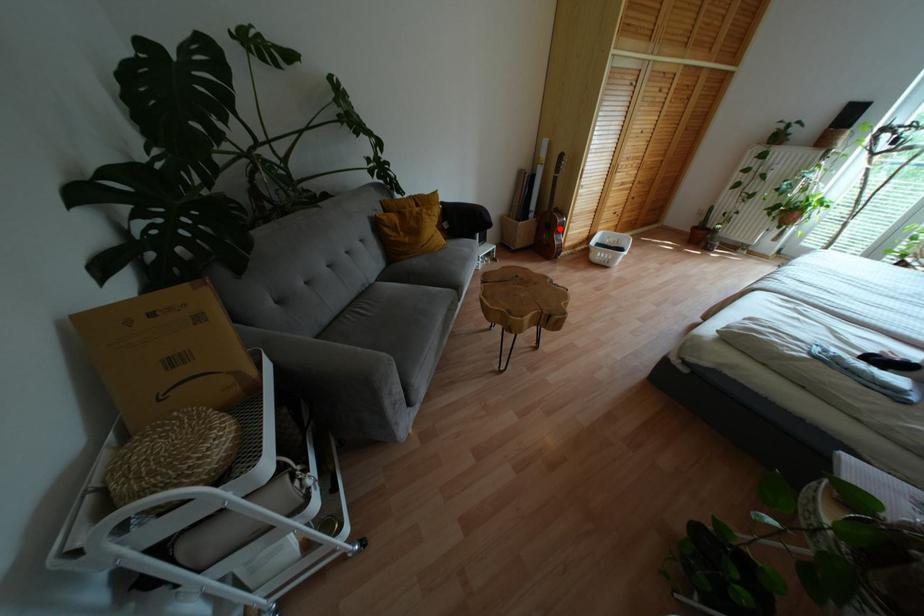
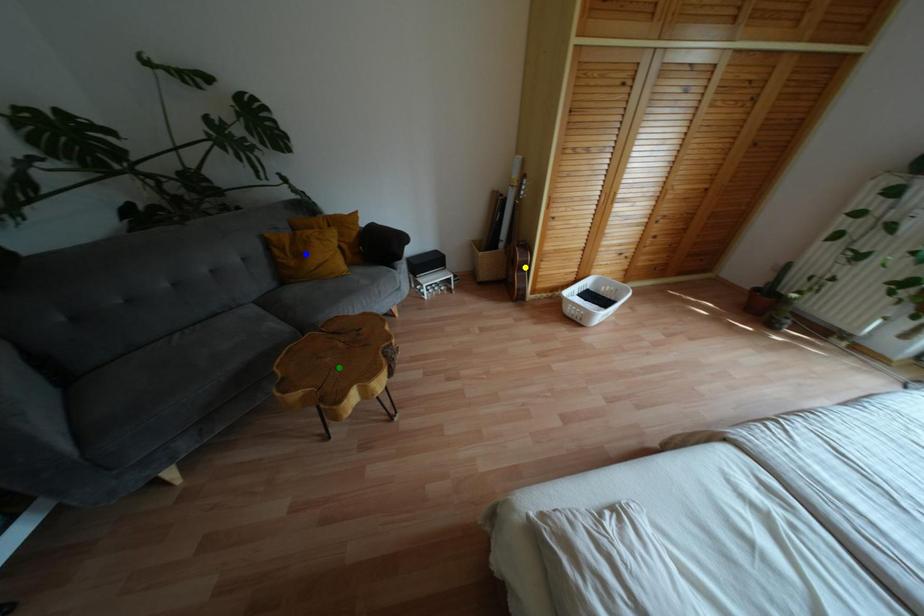
Question: I am providing you with two images of the same scene from different viewpoints. A red point is marked on the first image. You are given multiple points on the second image. In image 2, which mark is for the same physical point as the one in image 1?

Choices:
 (A) blue point
 (B) yellow point
 (C) green point

Answer: (B)